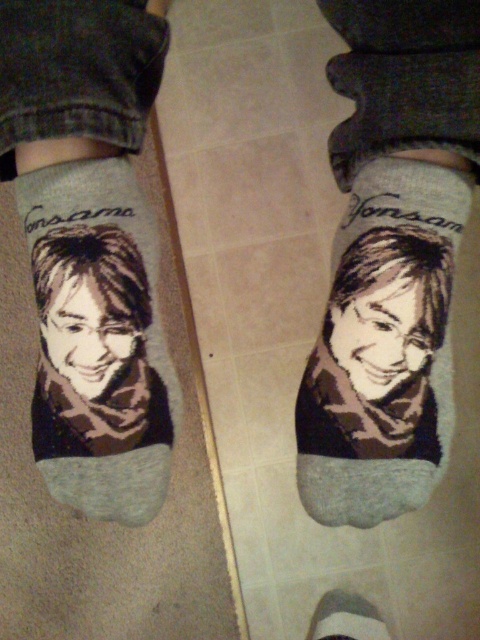
Based on the photo, you are trying to decide which pair of socks to wear today. You have two options in front of you on the floor. One is matte gray socks at center and the other is printed fabric socks at center. Based on their sizes, which one would you choose if you want the bigger pair?

The matte gray socks at center has a larger size compared to the printed fabric socks at center, so you should choose the matte gray socks at center if you want the bigger pair.

You are standing in a room with the image described. You want to pick up the printed fabric socks at center without touching the matte gray socks at center. Is this possible given their positions?

The matte gray socks at center is closer to the viewer than printed fabric socks at center, so you cannot pick up the printed fabric socks at center without moving the matte gray socks at center first.